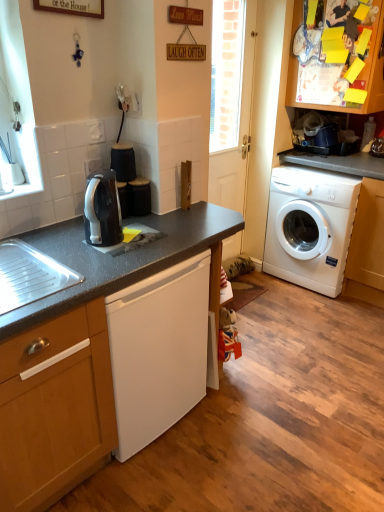
Locate an element on the screen. The image size is (384, 512). vacant region in front of black granite countertop at center is located at coordinates [198, 471].